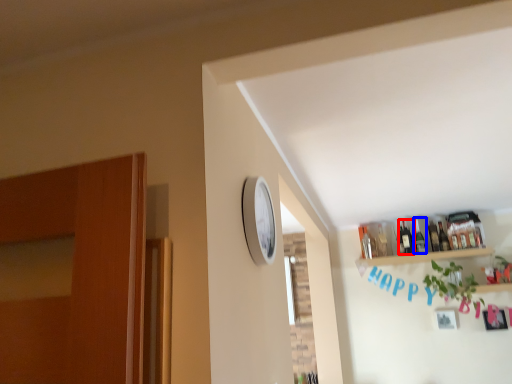
Question: Which object appears farthest to the camera in this image, bottle (highlighted by a red box) or bottle (highlighted by a blue box)?

Choices:
 (A) bottle
 (B) bottle

Answer: (B)